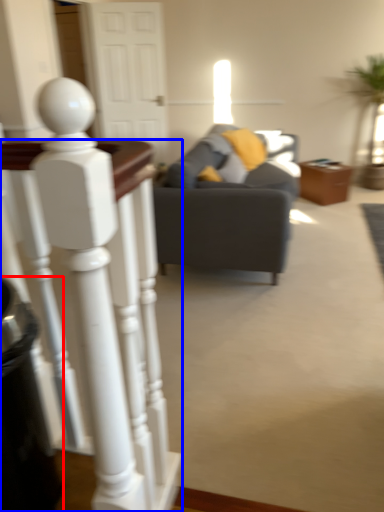
Question: Among these objects, which one is nearest to the camera, trash bin/can (highlighted by a red box) or desk (highlighted by a blue box)?

Choices:
 (A) trash bin/can
 (B) desk

Answer: (B)